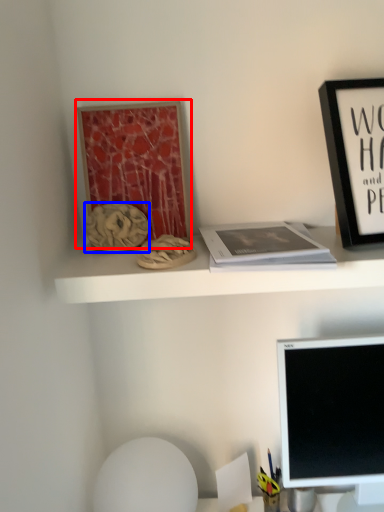
Question: Which of the following is the closest to the observer, bulletin board (highlighted by a red box) or art (highlighted by a blue box)?

Choices:
 (A) bulletin board
 (B) art

Answer: (B)